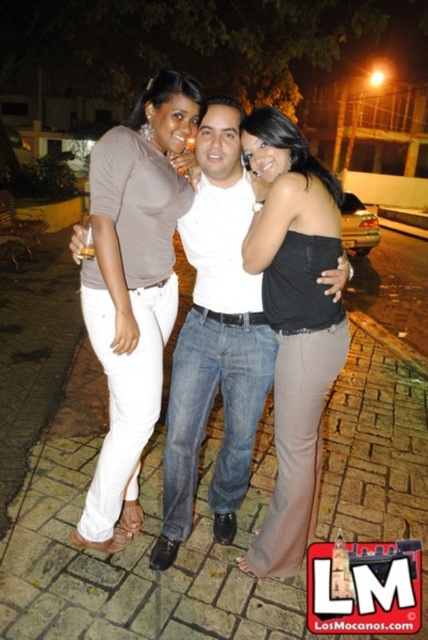
Question: Is matte brown shirt at upper left positioned at the back of black satin strapless top at center?

Choices:
 (A) no
 (B) yes

Answer: (B)

Question: Is matte brown shirt at upper left thinner than black satin strapless top at center?

Choices:
 (A) no
 (B) yes

Answer: (A)

Question: Which point is closer to the camera?

Choices:
 (A) black satin strapless top at center
 (B) matte brown shirt at upper left

Answer: (A)

Question: Can you confirm if matte brown shirt at upper left is positioned above black satin strapless top at center?

Choices:
 (A) no
 (B) yes

Answer: (B)

Question: Which of the following is the farthest from the observer?

Choices:
 (A) (112, 364)
 (B) (297, 477)

Answer: (B)